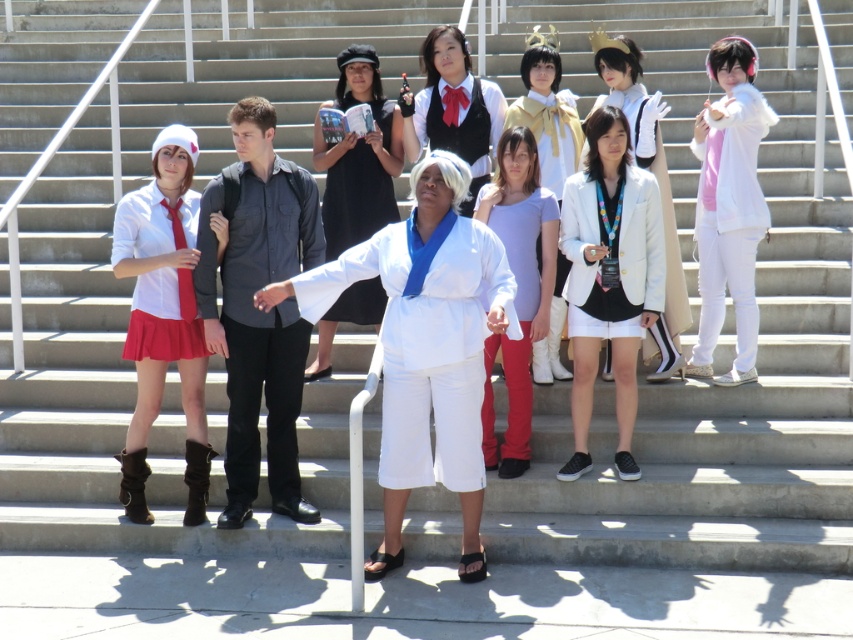
You are standing at the bottom of the stairs and want to hand a gift to the person wearing the white matte hoodie at right. Based on their position, where should you walk to reach them?

The white matte hoodie at right is located at point 0.345 on the x axis and 0.857 on the y axis, so you should walk towards the right side of the stairs near the upper part to reach them.

Looking at this image, you are a photographer standing at the bottom of the stairs. You need to adjust the camera focus so that both the white cotton karate uniform at center and the matte white shirt at left are in sharp focus. The camera has a depth of field that can cover 1.5 meters. Will both subjects be in focus?

The distance between the white cotton karate uniform at center and the matte white shirt at left is 1.43 meters, which is within the camera depth of field of 1.5 meters. Therefore, both subjects will be in focus.

You are a photographer trying to capture a group photo of the matte black shirt at center and the white matte jacket at center. The camera you are using has a maximum focus range of 2.5 meters. Can you take a clear photo of both subjects without moving the camera?

The matte black shirt at center is 2.55 meters from the white matte jacket at center. Since the distance between them exceeds the camera maximum focus range of 2.5 meters, you cannot take a clear photo of both subjects without moving the camera.